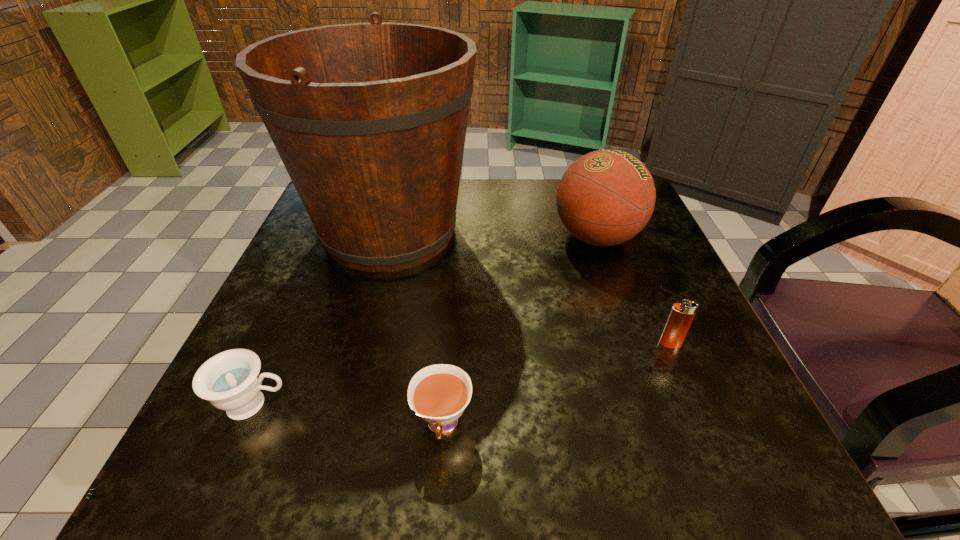
Identify the location of basketball positioned at the far edge. (606, 197).

The image size is (960, 540). In order to click on bucket situated at the left edge in this screenshot , I will do `click(369, 119)`.

Identify the location of teacup that is at the left edge. (231, 381).

Identify the location of basketball that is at the right edge. The width and height of the screenshot is (960, 540). (606, 197).

Where is `igniter that is at the right edge`? The width and height of the screenshot is (960, 540). igniter that is at the right edge is located at coordinates (682, 314).

The width and height of the screenshot is (960, 540). What are the coordinates of `object that is positioned at the far left corner` in the screenshot? It's located at (369, 119).

Locate an element on the screen. The image size is (960, 540). object positioned at the near left corner is located at coordinates (231, 381).

Image resolution: width=960 pixels, height=540 pixels. What are the coordinates of `object that is at the far right corner` in the screenshot? It's located at (606, 197).

Where is `free region at the far edge of the desktop`? The height and width of the screenshot is (540, 960). free region at the far edge of the desktop is located at coordinates (483, 210).

Locate an element on the screen. The image size is (960, 540). vacant region at the near edge of the desktop is located at coordinates (602, 426).